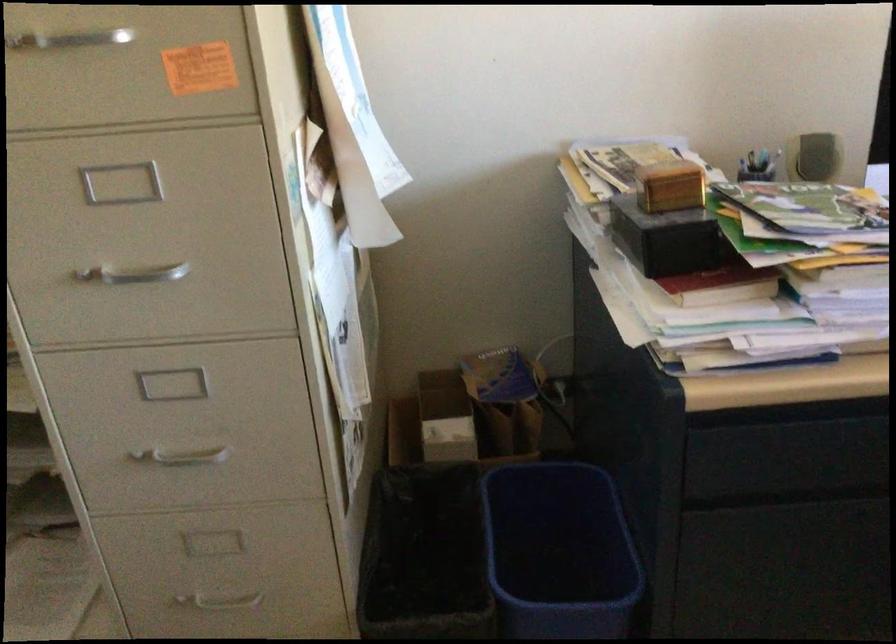
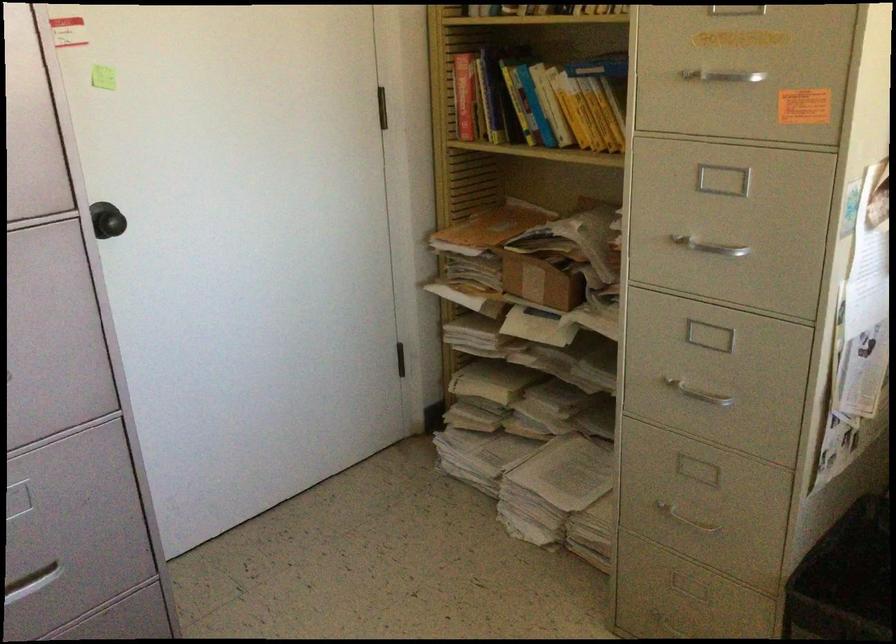
Where in the second image is the point corresponding to pixel 142 270 from the first image?

(710, 248)